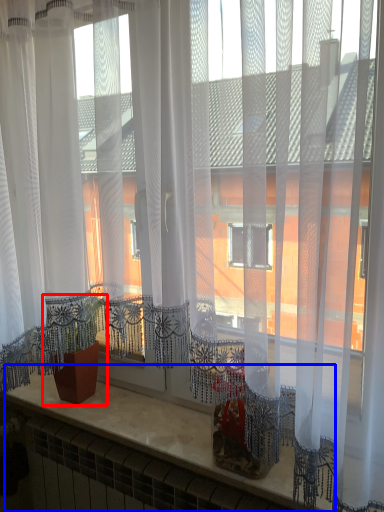
Question: Which object is further to the camera taking this photo, houseplant (highlighted by a red box) or counter top (highlighted by a blue box)?

Choices:
 (A) houseplant
 (B) counter top

Answer: (A)